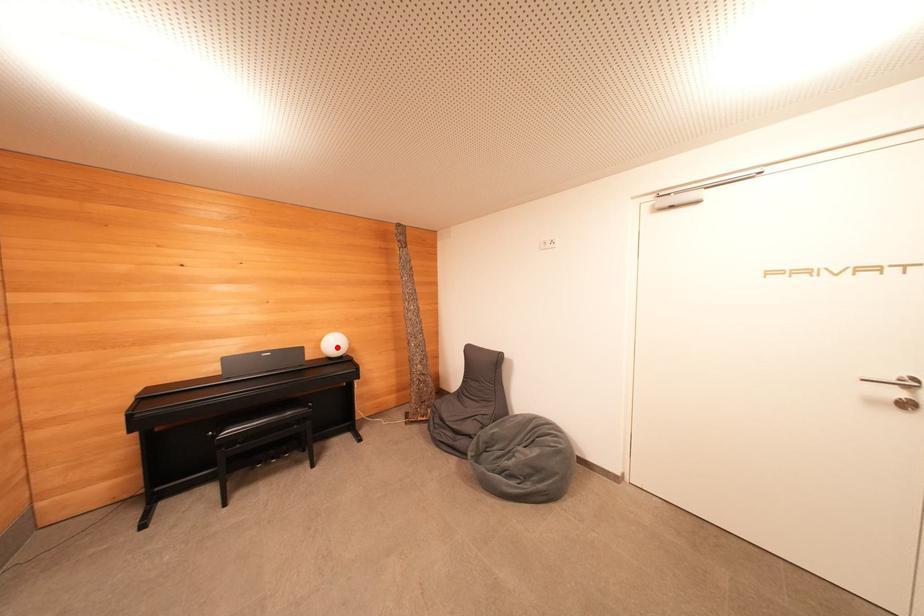
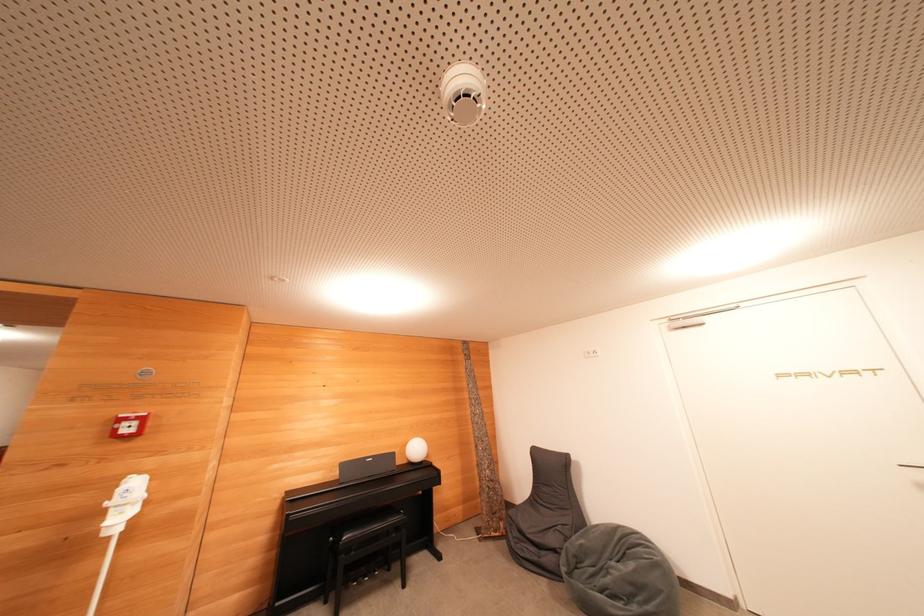
Find the pixel in the second image that matches the highlighted location in the first image.

(419, 453)